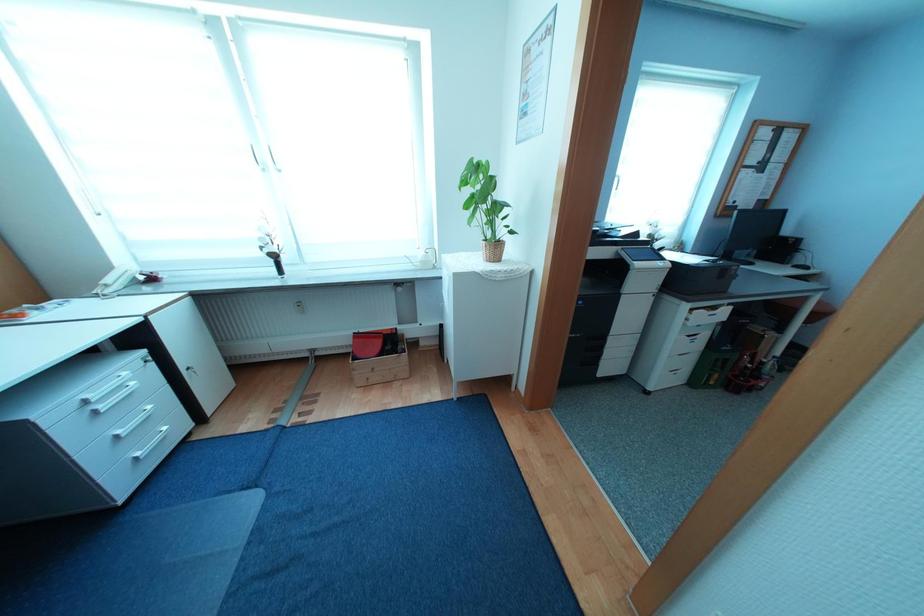
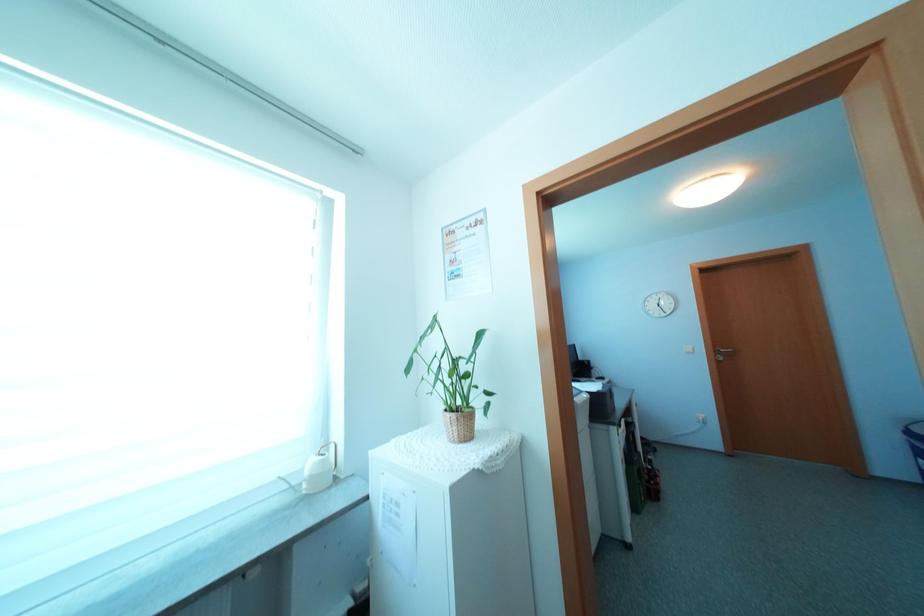
How did the camera likely rotate?

The camera rotated toward right-up.